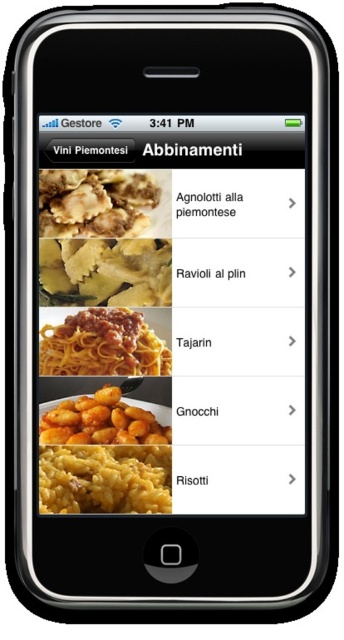
In the scene shown: You are using the wine pairing app on your phone and see the yellowish matte gnocchi at bottom and the brown matte ravioli at upper left. Which dish is positioned closer to the top of the screen?

The brown matte ravioli at upper left is closer to the top of the screen.

You are looking at a smartphone screen showing an app about wine and food pairings. The app lists two dishes, the yellowish matte gnocchi at bottom and the brown matte pasta at center. Which dish is positioned lower on the screen?

The yellowish matte gnocchi at bottom is positioned lower on the screen than the brown matte pasta at center.